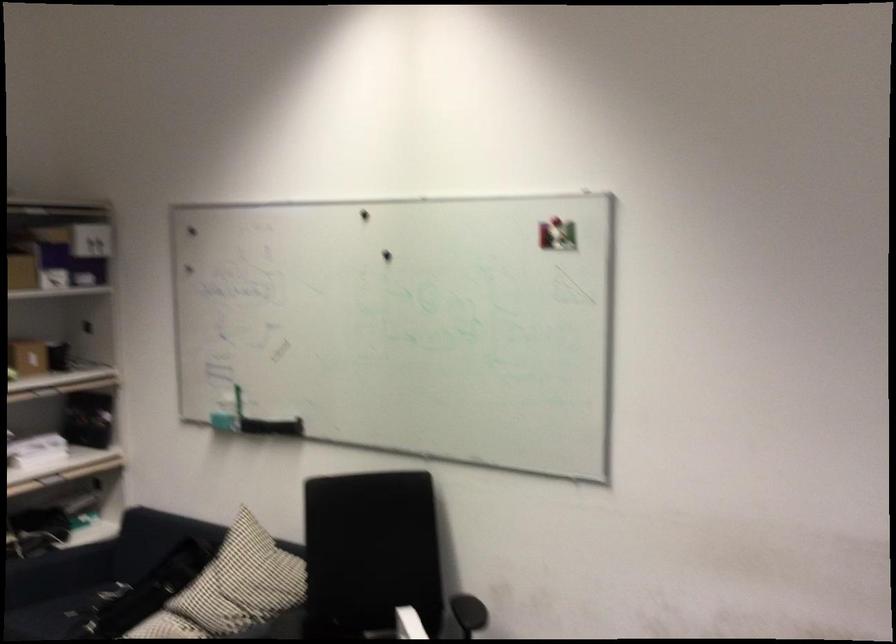
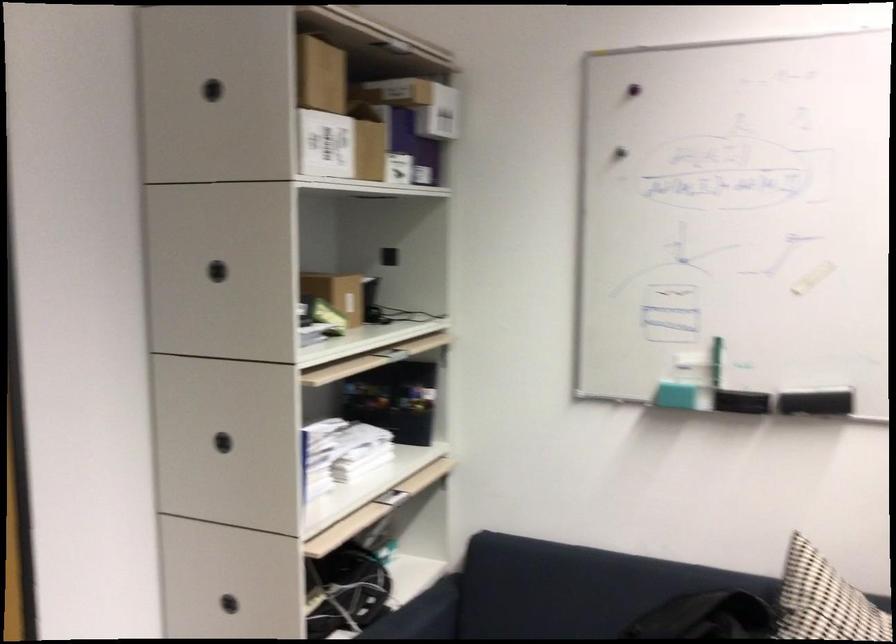
In the second image, find the point that corresponds to point 234,542 in the first image.

(823, 601)